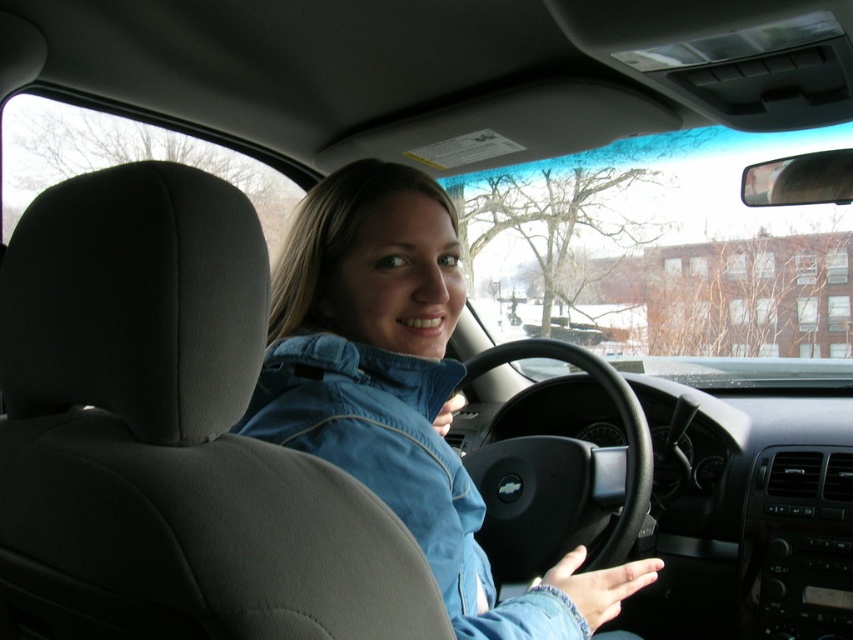
Between blue denim jacket at upper center and denim jacket at center, which one appears on the left side from the viewer's perspective?

blue denim jacket at upper center is more to the left.

Between blue denim jacket at upper center and denim jacket at center, which one has less height?

Standing shorter between the two is blue denim jacket at upper center.

The width and height of the screenshot is (853, 640). I want to click on blue denim jacket at upper center, so click(169, 436).

Does point (289, 353) lie behind point (550, 486)?

No.

Does denim jacket at center appear over black leather steering wheel at center?

Indeed, denim jacket at center is positioned over black leather steering wheel at center.

Which is in front, point (349, 209) or point (532, 518)?

Point (349, 209) is in front.

Image resolution: width=853 pixels, height=640 pixels. In order to click on denim jacket at center in this screenshot , I will do `click(401, 390)`.

This screenshot has width=853, height=640. Describe the element at coordinates (169, 436) in the screenshot. I see `blue denim jacket at upper center` at that location.

Does blue denim jacket at upper center appear under black leather steering wheel at center?

No, blue denim jacket at upper center is not below black leather steering wheel at center.

At what (x,y) coordinates should I click in order to perform the action: click on blue denim jacket at upper center. Please return your answer as a coordinate pair (x, y). The height and width of the screenshot is (640, 853). Looking at the image, I should click on 169,436.